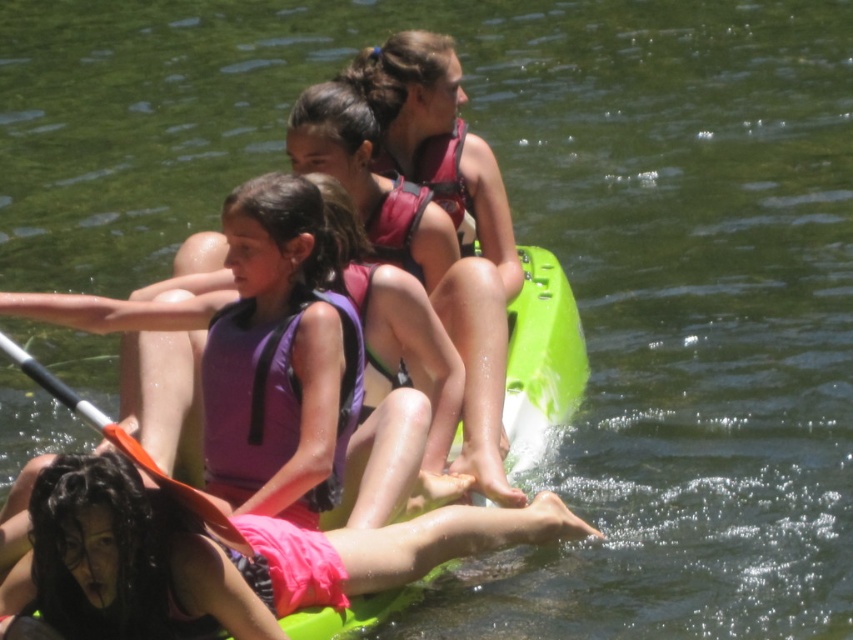
Question: Which object is closer to the camera taking this photo?

Choices:
 (A) pink fabric life vest at lower center
 (B) purple fabric life jacket at center
 (C) orange paddle at center
 (D) matte pink life jacket at center

Answer: (A)

Question: Estimate the real-world distances between objects in this image. Which object is farther from the pink fabric life vest at lower center?

Choices:
 (A) matte pink life jacket at center
 (B) orange paddle at center
 (C) purple fabric life jacket at center

Answer: (A)

Question: Is pink fabric life vest at lower center above matte pink life jacket at center?

Choices:
 (A) no
 (B) yes

Answer: (A)

Question: Can you confirm if pink fabric life vest at lower center is wider than matte pink life jacket at center?

Choices:
 (A) yes
 (B) no

Answer: (A)

Question: Which point is farther from the camera taking this photo?

Choices:
 (A) (27, 374)
 (B) (239, 406)

Answer: (B)

Question: Is pink fabric life vest at lower center below orange paddle at center?

Choices:
 (A) no
 (B) yes

Answer: (B)